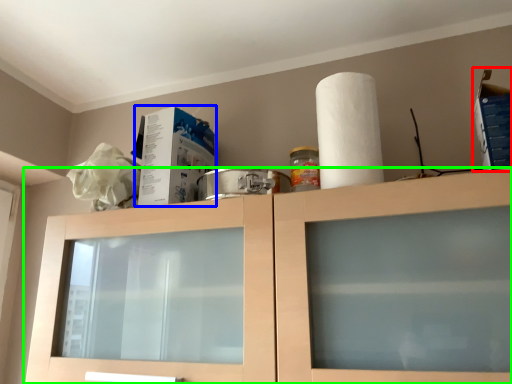
Question: Which object is positioned closest to box (highlighted by a red box)? Select from box (highlighted by a blue box) and cabinetry (highlighted by a green box).

Choices:
 (A) box
 (B) cabinetry

Answer: (B)